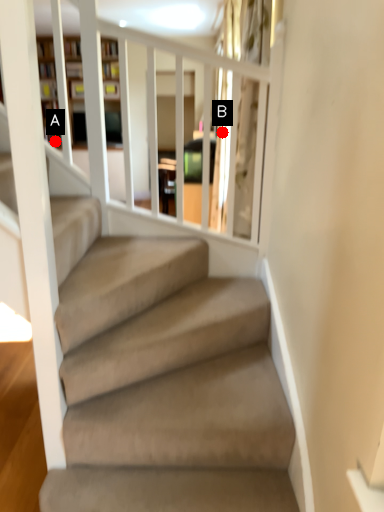
Question: Two points are circled on the image, labeled by A and B beside each circle. Among these points, which one is farthest from the camera?

Choices:
 (A) A is further
 (B) B is further

Answer: (B)